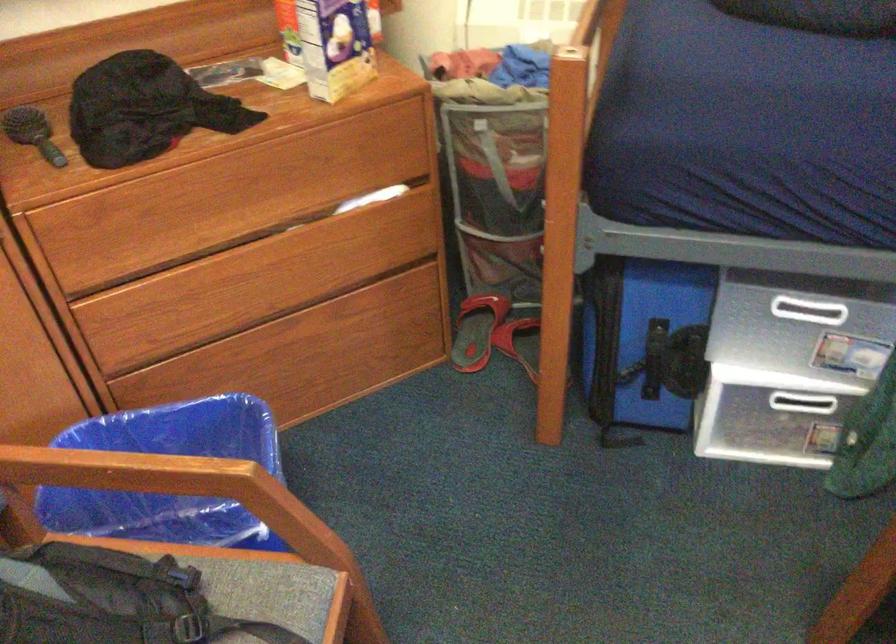
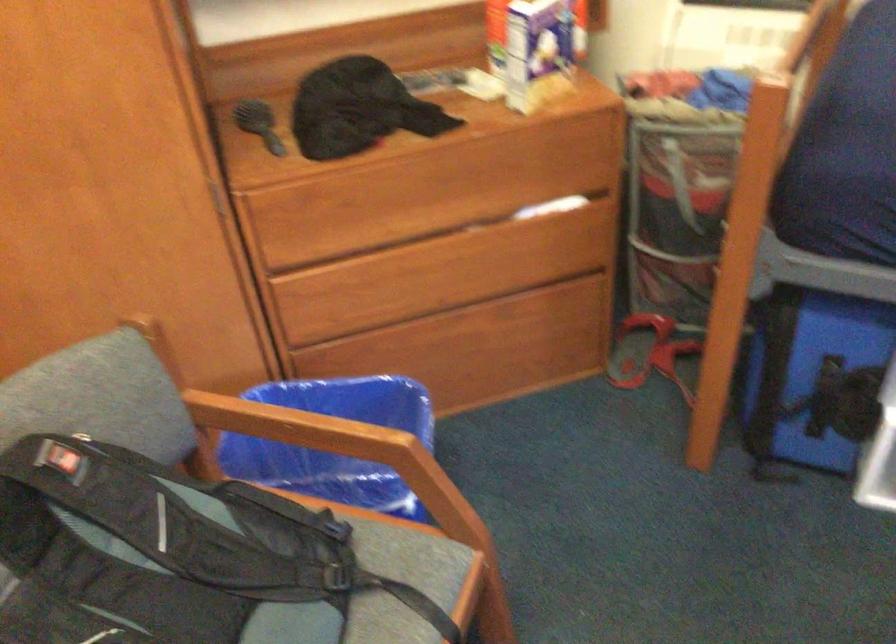
Where in the second image is the point corresponding to point 202,552 from the first image?

(352, 514)